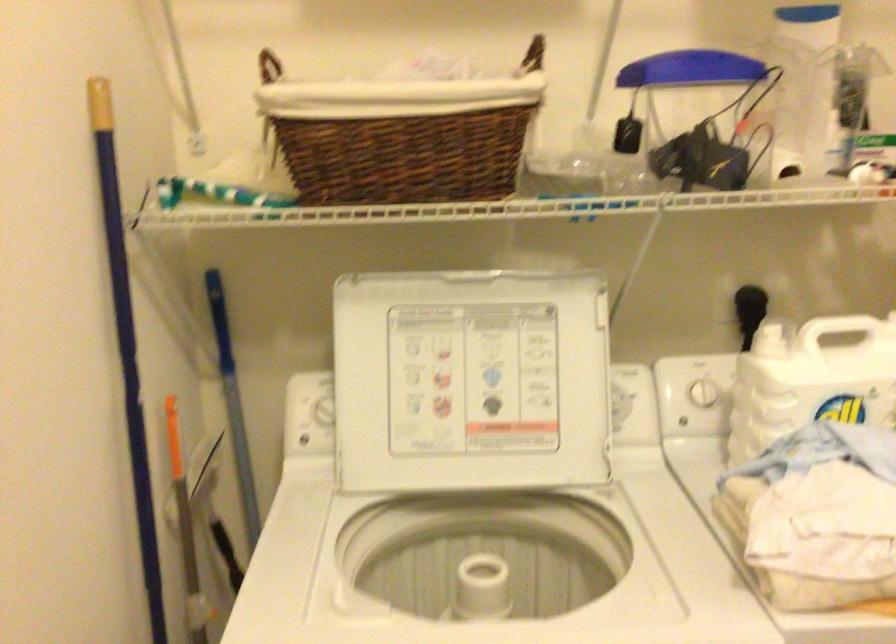
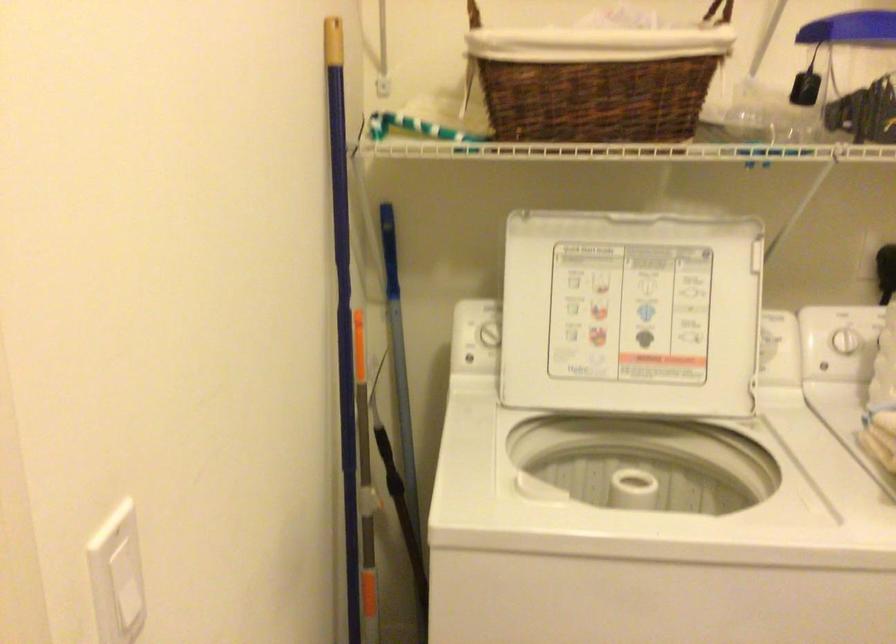
Question: The camera is either moving clockwise (left) or counter-clockwise (right) around the object. The first image is from the beginning of the video and the second image is from the end. Is the camera moving left or right when shooting the video?

Choices:
 (A) Left
 (B) Right

Answer: (B)